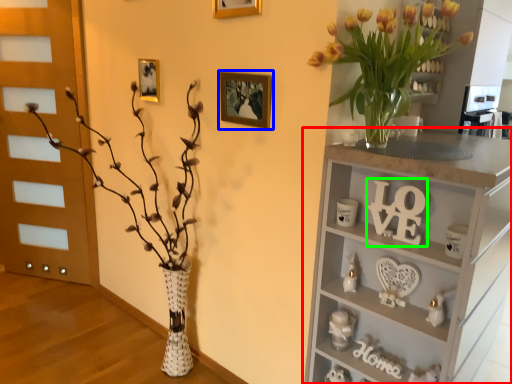
Question: Based on their relative distances, which object is nearer to shelf (highlighted by a red box)? Choose from picture frame (highlighted by a blue box) and number (highlighted by a green box).

Choices:
 (A) picture frame
 (B) number

Answer: (B)